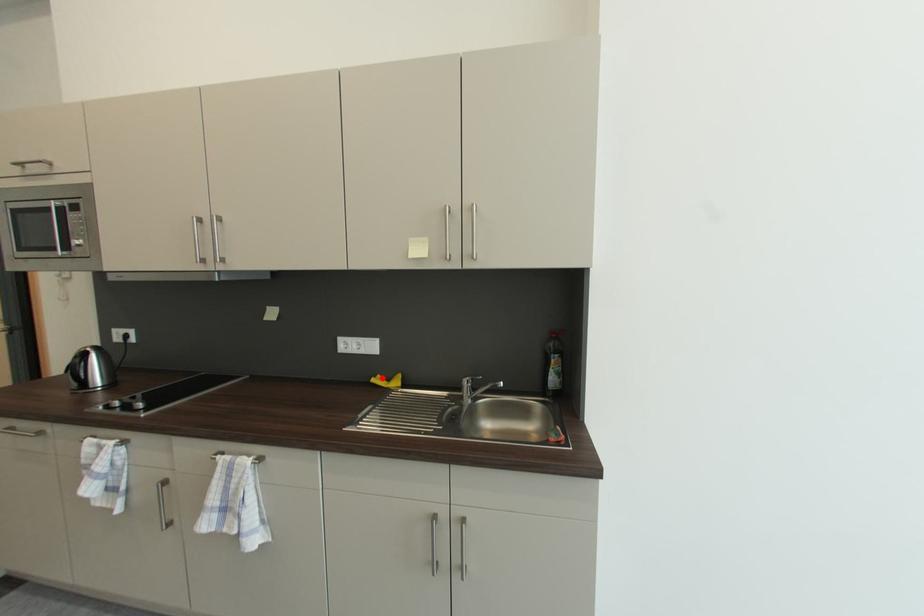
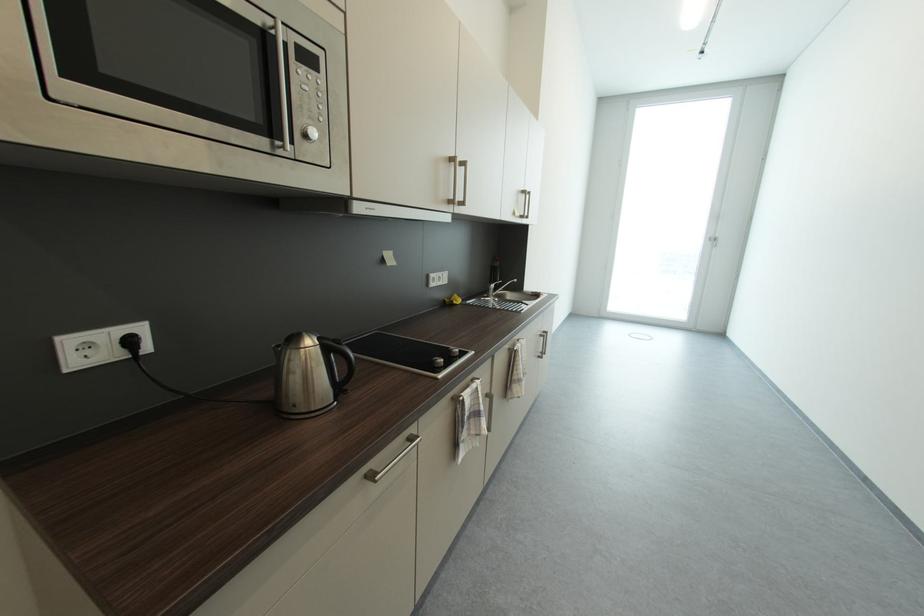
The point at the highlighted location is marked in the first image. Where is the corresponding point in the second image?

(453, 302)